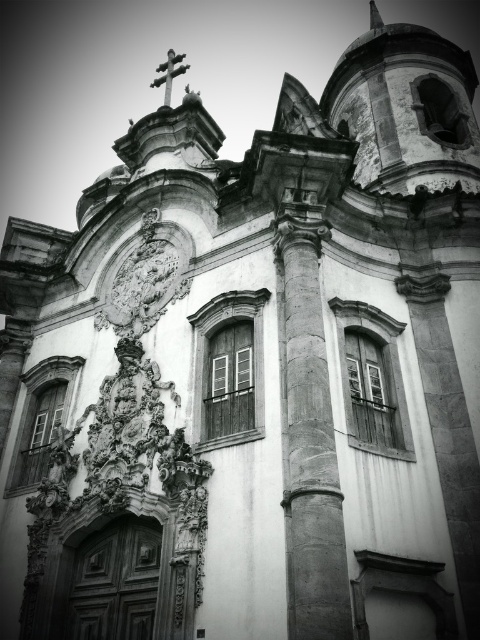
Question: Based on their relative distances, which object is farther from the smooth stone column at center?

Choices:
 (A) matte white clock at center
 (B) metallic cross at upper center

Answer: (B)

Question: Among these points, which one is nearest to the camera?

Choices:
 (A) (282, 244)
 (B) (51, 500)
 (C) (170, 65)

Answer: (B)

Question: Is smooth stone column at center below metallic cross at upper center?

Choices:
 (A) yes
 (B) no

Answer: (A)

Question: Can you confirm if smooth stone column at center is positioned to the right of matte white clock at center?

Choices:
 (A) yes
 (B) no

Answer: (A)

Question: Is metallic cross at upper center further to camera compared to matte white clock at center?

Choices:
 (A) yes
 (B) no

Answer: (A)

Question: Which is farther from the matte white clock at center?

Choices:
 (A) smooth stone column at center
 (B) metallic cross at upper center

Answer: (B)